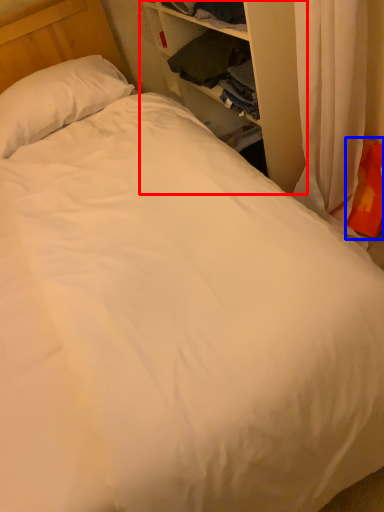
Question: Which point is further to the camera, dresser (highlighted by a red box) or pillow (highlighted by a blue box)?

Choices:
 (A) dresser
 (B) pillow

Answer: (B)